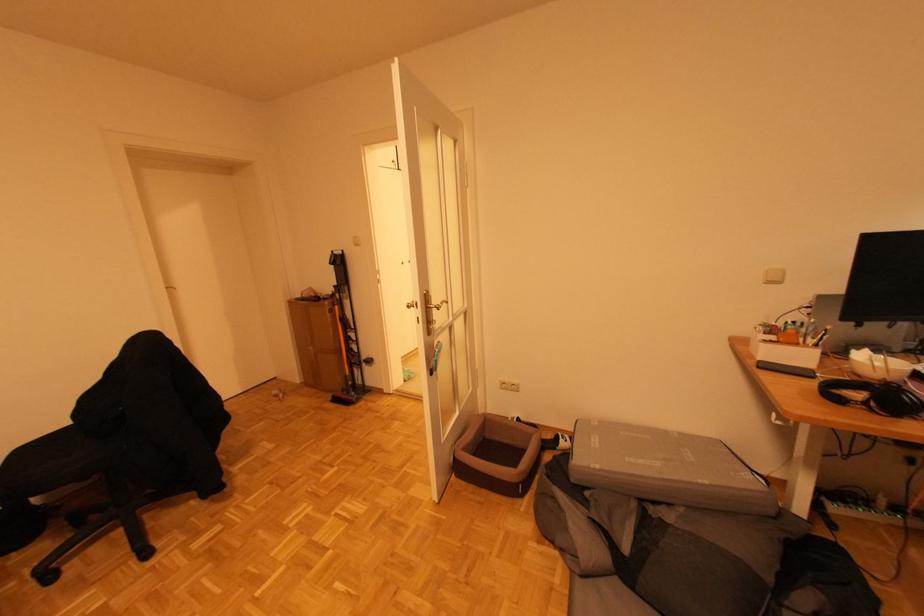
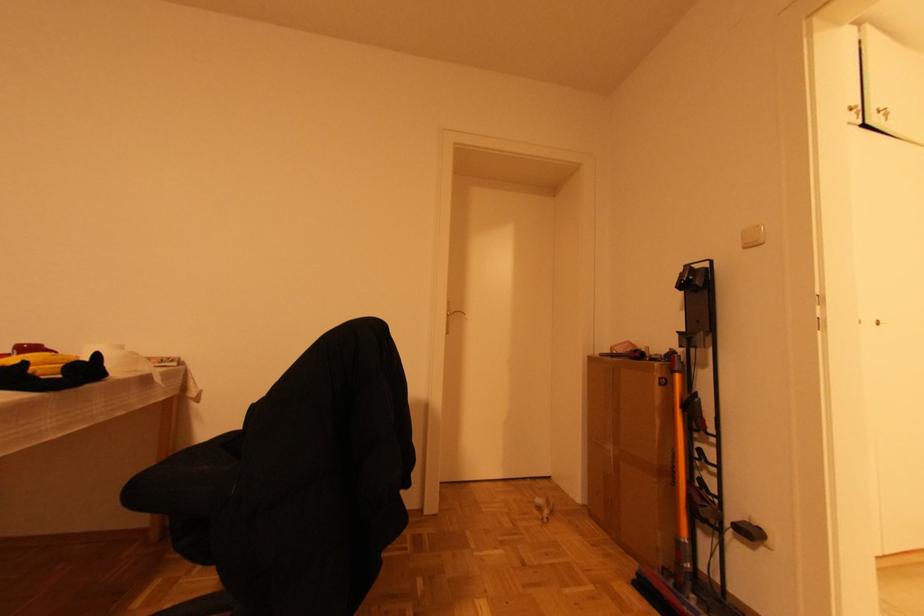
Find the pixel in the second image that matches (x=359, y=352) in the first image.

(716, 492)